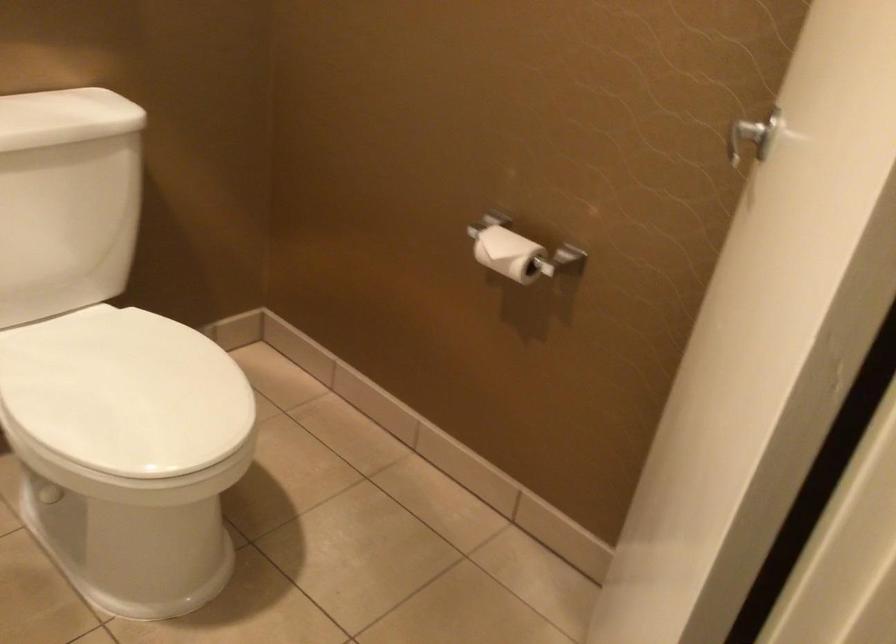
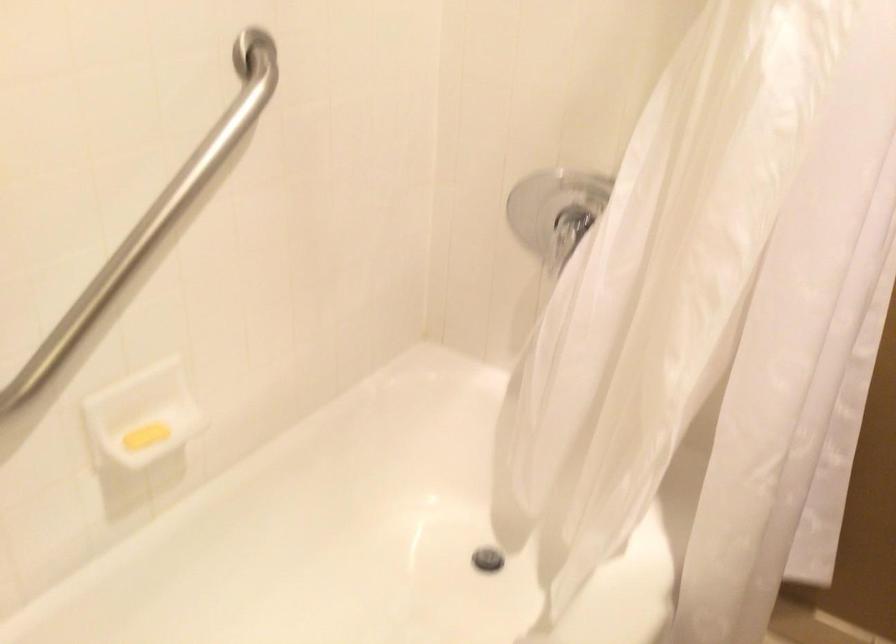
Question: How did the camera likely rotate?

Choices:
 (A) Left
 (B) Right
 (C) Up
 (D) Down

Answer: (A)